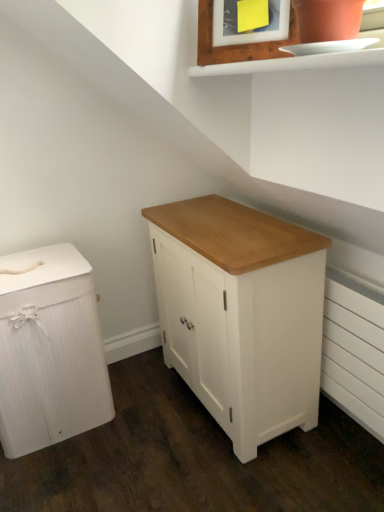
The image size is (384, 512). What do you see at coordinates (354, 350) in the screenshot?
I see `white painted radiator at lower right` at bounding box center [354, 350].

This screenshot has height=512, width=384. I want to click on white painted radiator at lower right, so click(x=354, y=350).

At what (x,y) coordinates should I click in order to perform the action: click on white painted wood cabinet at center, marked as the second chest of drawers in a left-to-right arrangement. Please return your answer as a coordinate pair (x, y). This screenshot has width=384, height=512. Looking at the image, I should click on (242, 314).

You are a GUI agent. You are given a task and a screenshot of the screen. Output one action in this format:
    pyautogui.click(x=<x>, y=<y>)
    Task: Click on the white painted radiator at lower right
    
    Given the screenshot: What is the action you would take?
    pyautogui.click(x=354, y=350)

Who is shorter, wooden picture frame at upper center or white painted wood cabinet at center, marked as the second chest of drawers in a left-to-right arrangement?

wooden picture frame at upper center.

From a real-world perspective, relative to white painted wood cabinet at center, the first chest of drawers viewed from the right, is wooden picture frame at upper center vertically above or below?

From a real-world perspective, wooden picture frame at upper center is physically above white painted wood cabinet at center, the first chest of drawers viewed from the right.

Is the depth of wooden picture frame at upper center less than that of white painted wood cabinet at center, marked as the second chest of drawers in a left-to-right arrangement?

Yes, wooden picture frame at upper center is in front of white painted wood cabinet at center, marked as the second chest of drawers in a left-to-right arrangement.

Where is `the 1st chest of drawers behind the wooden picture frame at upper center`? the 1st chest of drawers behind the wooden picture frame at upper center is located at coordinates (242, 314).

From the picture: In terms of height, does white painted wood cabinet at center, the first chest of drawers viewed from the right, look taller or shorter compared to white painted radiator at lower right?

Considering their sizes, white painted wood cabinet at center, the first chest of drawers viewed from the right, has more height than white painted radiator at lower right.

Considering the relative sizes of white painted wood cabinet at center, the first chest of drawers viewed from the right, and white painted radiator at lower right in the image provided, is white painted wood cabinet at center, the first chest of drawers viewed from the right, wider than white painted radiator at lower right?

Indeed, white painted wood cabinet at center, the first chest of drawers viewed from the right, has a greater width compared to white painted radiator at lower right.

Is white painted wood cabinet at center, marked as the second chest of drawers in a left-to-right arrangement, oriented towards white painted radiator at lower right?

No, white painted wood cabinet at center, marked as the second chest of drawers in a left-to-right arrangement, is not turned towards white painted radiator at lower right.

Consider the image. Is wooden picture frame at upper center behind white wood chest of drawers at left, the second chest of drawers positioned from the right?

No, it is not.

Is wooden picture frame at upper center completely or partially outside of white wood chest of drawers at left, which is the 1th chest of drawers in left-to-right order?

Yes, wooden picture frame at upper center is located beyond the bounds of white wood chest of drawers at left, which is the 1th chest of drawers in left-to-right order.

Based on the photo, does wooden picture frame at upper center have a smaller size compared to white wood chest of drawers at left, the second chest of drawers positioned from the right?

Correct, wooden picture frame at upper center occupies less space than white wood chest of drawers at left, the second chest of drawers positioned from the right.

Would you say wooden picture frame at upper center is to the left or to the right of white wood chest of drawers at left, the second chest of drawers positioned from the right, in the picture?

Based on their positions, wooden picture frame at upper center is located to the right of white wood chest of drawers at left, the second chest of drawers positioned from the right.

Considering the relative sizes of white painted radiator at lower right and white painted wood cabinet at center, the first chest of drawers viewed from the right, in the image provided, is white painted radiator at lower right bigger than white painted wood cabinet at center, the first chest of drawers viewed from the right,?

Actually, white painted radiator at lower right might be smaller than white painted wood cabinet at center, the first chest of drawers viewed from the right.

Is the depth of white painted radiator at lower right less than that of white painted wood cabinet at center, marked as the second chest of drawers in a left-to-right arrangement?

No.

From the image's perspective, is white painted radiator at lower right under white painted wood cabinet at center, marked as the second chest of drawers in a left-to-right arrangement?

Indeed, from the image's perspective, white painted radiator at lower right is shown beneath white painted wood cabinet at center, marked as the second chest of drawers in a left-to-right arrangement.

Between white painted radiator at lower right and white painted wood cabinet at center, marked as the second chest of drawers in a left-to-right arrangement, which one has more height?

With more height is white painted wood cabinet at center, marked as the second chest of drawers in a left-to-right arrangement.

From the image's perspective, who appears lower, white wood chest of drawers at left, the second chest of drawers positioned from the right, or white painted wood cabinet at center, marked as the second chest of drawers in a left-to-right arrangement?

white wood chest of drawers at left, the second chest of drawers positioned from the right, is shown below in the image.

Which of these two, white wood chest of drawers at left, which is the 1th chest of drawers in left-to-right order, or white painted wood cabinet at center, the first chest of drawers viewed from the right, stands taller?

With more height is white painted wood cabinet at center, the first chest of drawers viewed from the right.

Is white wood chest of drawers at left, the second chest of drawers positioned from the right, turned away from white painted wood cabinet at center, the first chest of drawers viewed from the right?

No.

Locate an element on the screen. The height and width of the screenshot is (512, 384). chest of drawers above the white wood chest of drawers at left, the second chest of drawers positioned from the right (from the image's perspective) is located at coordinates (242, 314).

From a real-world perspective, is white painted wood cabinet at center, the first chest of drawers viewed from the right, located beneath white wood chest of drawers at left, which is the 1th chest of drawers in left-to-right order?

No, from a real-world perspective, white painted wood cabinet at center, the first chest of drawers viewed from the right, is not beneath white wood chest of drawers at left, which is the 1th chest of drawers in left-to-right order.

Which object is wider, white painted wood cabinet at center, marked as the second chest of drawers in a left-to-right arrangement, or white wood chest of drawers at left, the second chest of drawers positioned from the right?

white wood chest of drawers at left, the second chest of drawers positioned from the right, is wider.

Does point (193, 277) appear closer or farther from the camera than point (74, 354)?

Point (193, 277).

Consider the image. Is white painted wood cabinet at center, marked as the second chest of drawers in a left-to-right arrangement, positioned beyond the bounds of white wood chest of drawers at left, the second chest of drawers positioned from the right?

Yes, white painted wood cabinet at center, marked as the second chest of drawers in a left-to-right arrangement, is not within white wood chest of drawers at left, the second chest of drawers positioned from the right.

Can you tell me how much white painted wood cabinet at center, marked as the second chest of drawers in a left-to-right arrangement, and wooden picture frame at upper center differ in facing direction?

The angular difference between white painted wood cabinet at center, marked as the second chest of drawers in a left-to-right arrangement, and wooden picture frame at upper center is 38.6 degrees.

Does white painted wood cabinet at center, marked as the second chest of drawers in a left-to-right arrangement, contain wooden picture frame at upper center?

No, white painted wood cabinet at center, marked as the second chest of drawers in a left-to-right arrangement, does not contain wooden picture frame at upper center.

Is white painted wood cabinet at center, marked as the second chest of drawers in a left-to-right arrangement, oriented away from wooden picture frame at upper center?

No, wooden picture frame at upper center is not at the back of white painted wood cabinet at center, marked as the second chest of drawers in a left-to-right arrangement.

Between white painted wood cabinet at center, the first chest of drawers viewed from the right, and wooden picture frame at upper center, which one has less height?

With less height is wooden picture frame at upper center.

From the image's perspective, count 1st chest of drawerss downward from the wooden picture frame at upper center and point to it. Please provide its 2D coordinates.

[(242, 314)]

Identify the location of the chest of drawers that is the 2nd object above the white painted radiator at lower right (from a real-world perspective). (242, 314).

From the image, which object appears to be nearer to white painted wood cabinet at center, marked as the second chest of drawers in a left-to-right arrangement, wooden picture frame at upper center or white wood chest of drawers at left, the second chest of drawers positioned from the right?

Based on the image, white wood chest of drawers at left, the second chest of drawers positioned from the right, appears to be nearer to white painted wood cabinet at center, marked as the second chest of drawers in a left-to-right arrangement.

Considering their positions, is wooden picture frame at upper center positioned closer to white painted wood cabinet at center, marked as the second chest of drawers in a left-to-right arrangement, than white painted radiator at lower right?

white painted radiator at lower right lies closer to white painted wood cabinet at center, marked as the second chest of drawers in a left-to-right arrangement, than the other object.

Looking at the image, which one is located further to white wood chest of drawers at left, which is the 1th chest of drawers in left-to-right order, wooden picture frame at upper center or white painted radiator at lower right?

Among the two, wooden picture frame at upper center is located further to white wood chest of drawers at left, which is the 1th chest of drawers in left-to-right order.

Based on their spatial positions, is white wood chest of drawers at left, which is the 1th chest of drawers in left-to-right order, or white painted wood cabinet at center, marked as the second chest of drawers in a left-to-right arrangement, further from wooden picture frame at upper center?

Based on the image, white wood chest of drawers at left, which is the 1th chest of drawers in left-to-right order, appears to be further to wooden picture frame at upper center.

Based on their spatial positions, is white wood chest of drawers at left, the second chest of drawers positioned from the right, or white painted wood cabinet at center, marked as the second chest of drawers in a left-to-right arrangement, closer to white painted radiator at lower right?

white painted wood cabinet at center, marked as the second chest of drawers in a left-to-right arrangement, is closer to white painted radiator at lower right.

From the image, which object appears to be farther from white wood chest of drawers at left, the second chest of drawers positioned from the right, white painted wood cabinet at center, the first chest of drawers viewed from the right, or white painted radiator at lower right?

Based on the image, white painted radiator at lower right appears to be further to white wood chest of drawers at left, the second chest of drawers positioned from the right.

From the image, which object appears to be nearer to wooden picture frame at upper center, white painted radiator at lower right or white wood chest of drawers at left, which is the 1th chest of drawers in left-to-right order?

Based on the image, white painted radiator at lower right appears to be nearer to wooden picture frame at upper center.

Considering their positions, is white wood chest of drawers at left, the second chest of drawers positioned from the right, positioned further to white painted wood cabinet at center, marked as the second chest of drawers in a left-to-right arrangement, than white painted radiator at lower right?

The object further to white painted wood cabinet at center, marked as the second chest of drawers in a left-to-right arrangement, is white wood chest of drawers at left, the second chest of drawers positioned from the right.

The image size is (384, 512). What are the coordinates of `chest of drawers between white wood chest of drawers at left, the second chest of drawers positioned from the right, and white painted radiator at lower right` in the screenshot? It's located at (242, 314).

I want to click on chest of drawers between wooden picture frame at upper center and white wood chest of drawers at left, which is the 1th chest of drawers in left-to-right order, in the vertical direction, so click(x=242, y=314).

Find the location of `picture frame located between white wood chest of drawers at left, which is the 1th chest of drawers in left-to-right order, and white painted radiator at lower right in the left-right direction`. picture frame located between white wood chest of drawers at left, which is the 1th chest of drawers in left-to-right order, and white painted radiator at lower right in the left-right direction is located at coordinates (237, 45).